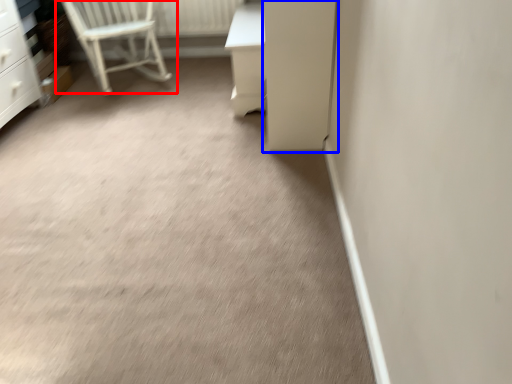
Question: Among these objects, which one is farthest to the camera, chair (highlighted by a red box) or screen door (highlighted by a blue box)?

Choices:
 (A) chair
 (B) screen door

Answer: (A)